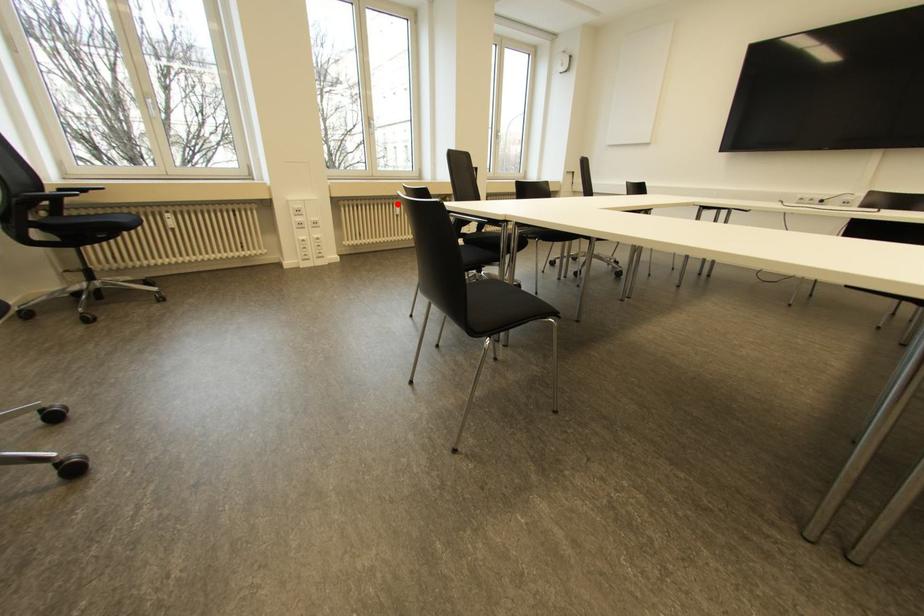
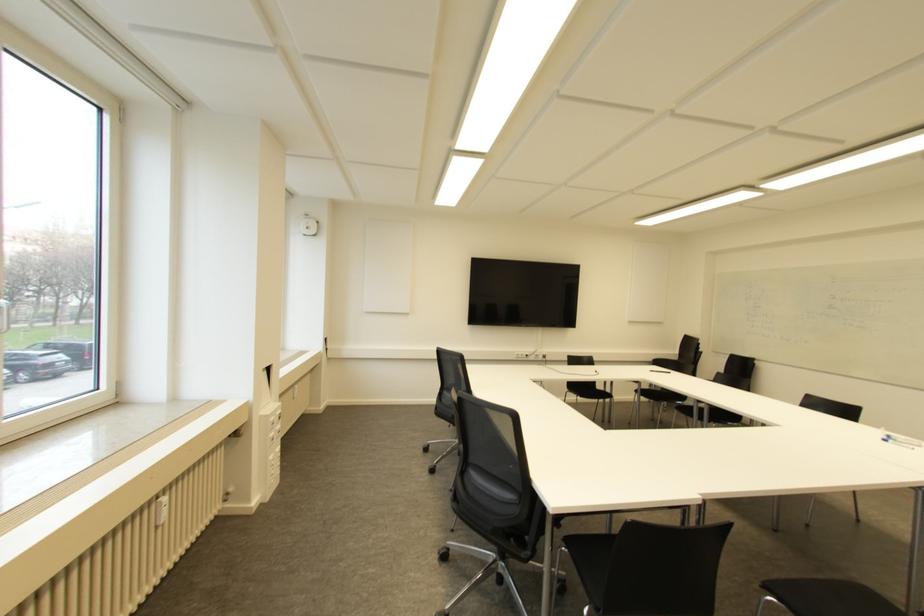
Locate, in the second image, the point that corresponds to the highlighted location in the first image.

(163, 499)